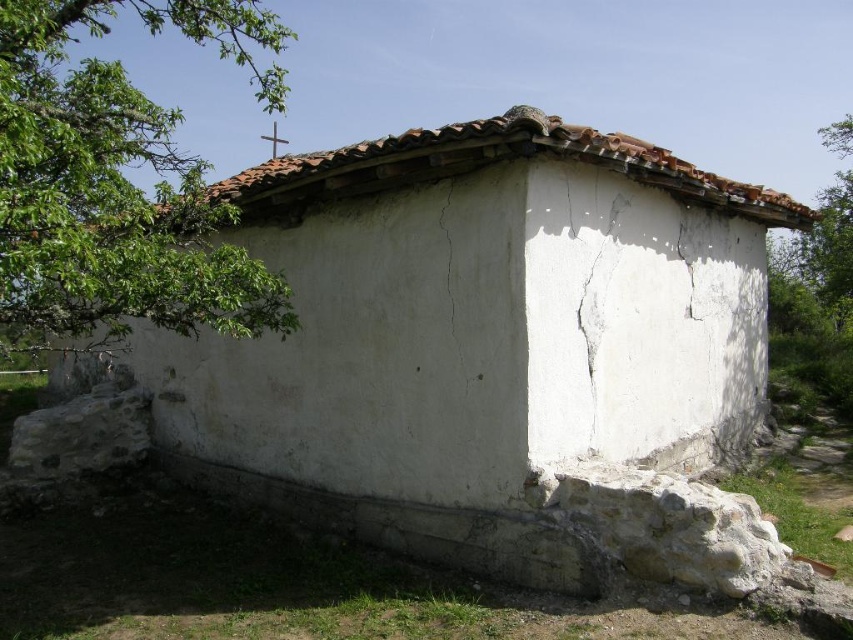
Is the position of green leafy branch at upper left more distant than that of green leafy tree at upper right?

No, green leafy branch at upper left is closer to the viewer.

Can you confirm if green leafy branch at upper left is taller than green leafy tree at upper right?

Yes, green leafy branch at upper left is taller than green leafy tree at upper right.

Find the location of a particular element. Image resolution: width=853 pixels, height=640 pixels. green leafy branch at upper left is located at coordinates (119, 180).

Find the location of a particular element. The image size is (853, 640). green leafy branch at upper left is located at coordinates (119, 180).

Does brown tile roof at upper center have a smaller size compared to white plaster crack at upper center?

No, brown tile roof at upper center is not smaller than white plaster crack at upper center.

Can you confirm if brown tile roof at upper center is positioned above white plaster crack at upper center?

Yes.

This screenshot has width=853, height=640. Find the location of `brown tile roof at upper center`. brown tile roof at upper center is located at coordinates (486, 163).

Which is below, white plastered hut at center or white plaster crack at upper center?

Positioned lower is white plastered hut at center.

Who is positioned more to the left, white plastered hut at center or white plaster crack at upper center?

white plastered hut at center is more to the left.

What do you see at coordinates (491, 353) in the screenshot? The image size is (853, 640). I see `white plastered hut at center` at bounding box center [491, 353].

Image resolution: width=853 pixels, height=640 pixels. Identify the location of white plastered hut at center. (491, 353).